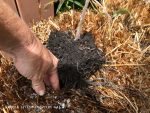
The width and height of the screenshot is (150, 113). What are the coordinates of `plant` in the screenshot? It's located at (60, 6).